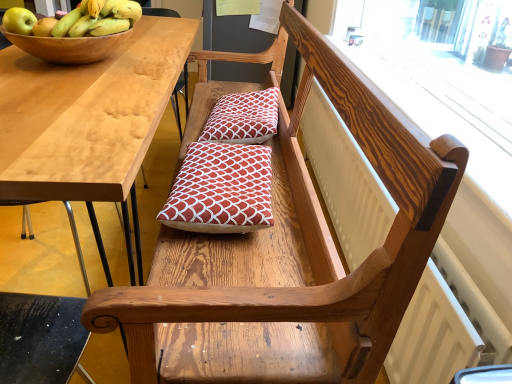
Question: Does red printed cushion at center, positioned as the 1th pillow in top-to-bottom order, have a larger size compared to yellow matte bananas at upper left?

Choices:
 (A) no
 (B) yes

Answer: (B)

Question: Is red printed cushion at center, the 2th pillow when ordered from bottom to top, smaller than yellow matte bananas at upper left?

Choices:
 (A) yes
 (B) no

Answer: (B)

Question: Does red printed cushion at center, which is counted as the second pillow, starting from the front, have a lesser width compared to yellow matte bananas at upper left?

Choices:
 (A) yes
 (B) no

Answer: (B)

Question: From the image's perspective, is red printed cushion at center, positioned as the 1th pillow in top-to-bottom order, below yellow matte bananas at upper left?

Choices:
 (A) yes
 (B) no

Answer: (A)

Question: From a real-world perspective, is red printed cushion at center, which is counted as the second pillow, starting from the front, physically below yellow matte bananas at upper left?

Choices:
 (A) yes
 (B) no

Answer: (A)

Question: Is red printed cushion at center, the 2th pillow when ordered from bottom to top, wider than yellow matte bananas at upper left?

Choices:
 (A) yes
 (B) no

Answer: (A)

Question: Does light wood table at left contain green matte apple at upper left?

Choices:
 (A) no
 (B) yes

Answer: (A)

Question: Is light wood table at left positioned with its back to green matte apple at upper left?

Choices:
 (A) yes
 (B) no

Answer: (B)

Question: Considering the relative positions of light wood table at left and green matte apple at upper left in the image provided, is light wood table at left to the left of green matte apple at upper left from the viewer's perspective?

Choices:
 (A) no
 (B) yes

Answer: (A)

Question: Is light wood table at left oriented towards green matte apple at upper left?

Choices:
 (A) no
 (B) yes

Answer: (A)

Question: From a real-world perspective, does light wood table at left sit lower than green matte apple at upper left?

Choices:
 (A) yes
 (B) no

Answer: (A)

Question: Is light wood table at left outside of green matte apple at upper left?

Choices:
 (A) yes
 (B) no

Answer: (A)

Question: From the image's perspective, would you say red printed cushion at center, the first pillow positioned from the bottom, is positioned over green matte apple at upper left?

Choices:
 (A) no
 (B) yes

Answer: (A)